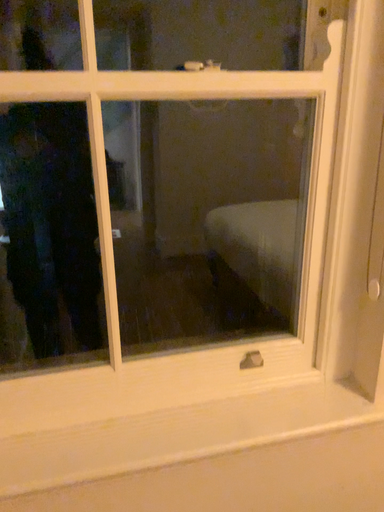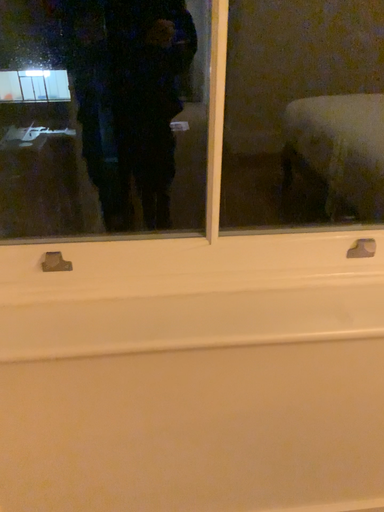
Question: How did the camera likely rotate when shooting the video?

Choices:
 (A) rotated downward
 (B) rotated upward

Answer: (A)